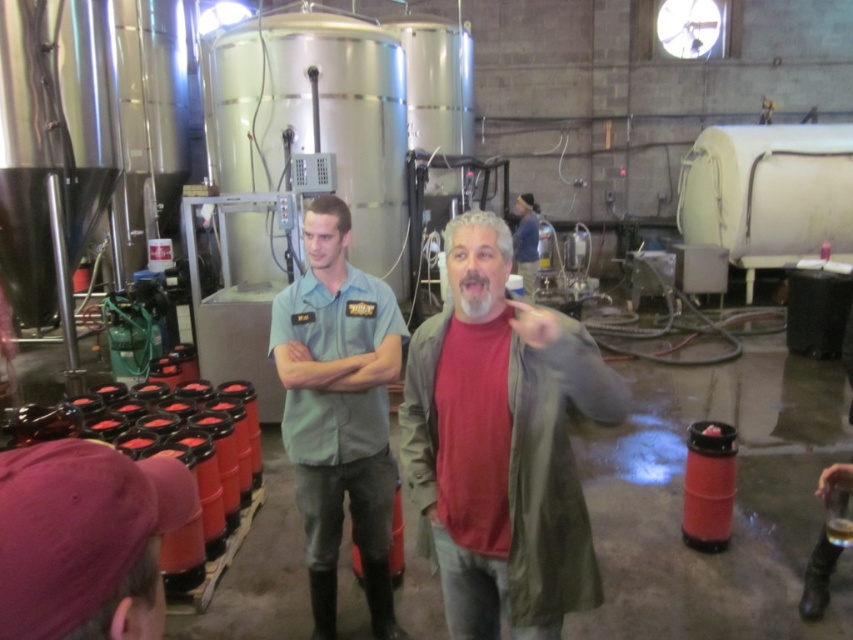
You are an employee in the brewery and need to hang both jackets on a rack. The rack has two hooks. The upper hook is 1.5 meters high, and the lower hook is 1 meter high. If you want to hang the red matte jacket at center higher than the blue denim jacket at center, which hook should each jacket go on?

The red matte jacket at center should be placed on the upper hook at 1.5 meters, and the blue denim jacket at center on the lower hook at 1 meter to satisfy the requirement.

You are standing in the brewery and want to determine which of the two points, point (519, 538) or point (531, 291), is nearer to you. Based on the scene, which point is closer?

Point (519, 538) is closer to the camera than point (531, 291), so it is the nearer one.